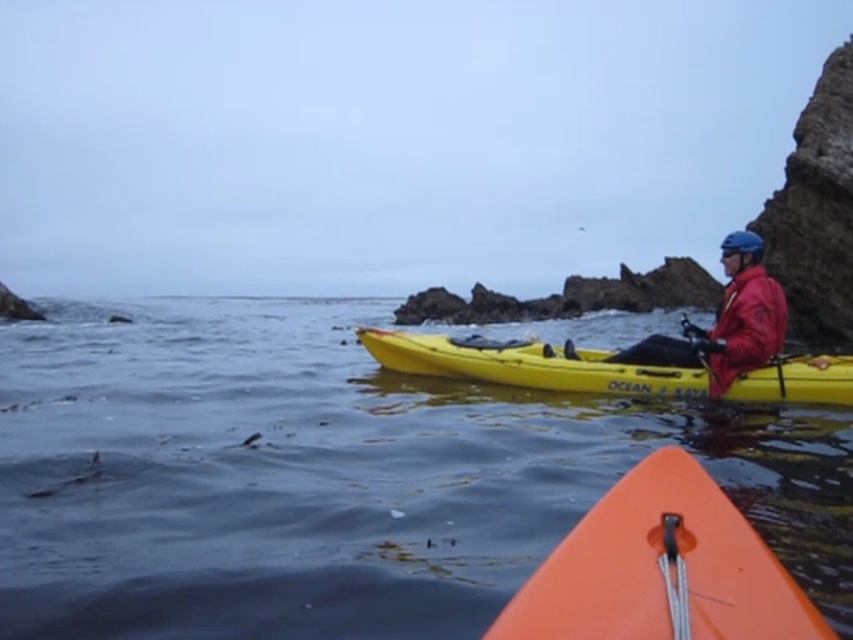
Between clear water at center and red matte jacket at right, which one appears on the left side from the viewer's perspective?

Positioned to the left is clear water at center.

In the scene shown: Which of these two, clear water at center or red matte jacket at right, stands shorter?

red matte jacket at right

The width and height of the screenshot is (853, 640). What do you see at coordinates (335, 476) in the screenshot?
I see `clear water at center` at bounding box center [335, 476].

The height and width of the screenshot is (640, 853). What are the coordinates of `clear water at center` in the screenshot? It's located at (335, 476).

Is orange matte kayak at lower center below red matte life jacket at right?

Correct, orange matte kayak at lower center is located below red matte life jacket at right.

Does orange matte kayak at lower center have a lesser width compared to red matte life jacket at right?

Incorrect, orange matte kayak at lower center's width is not less than red matte life jacket at right's.

Where is `orange matte kayak at lower center`? The image size is (853, 640). orange matte kayak at lower center is located at coordinates (660, 568).

Who is more distant from viewer, (636, 573) or (763, 340)?

Positioned behind is point (763, 340).

Where is `orange matte kayak at lower center`? orange matte kayak at lower center is located at coordinates (660, 568).

Identify the location of orange matte kayak at lower center. (660, 568).